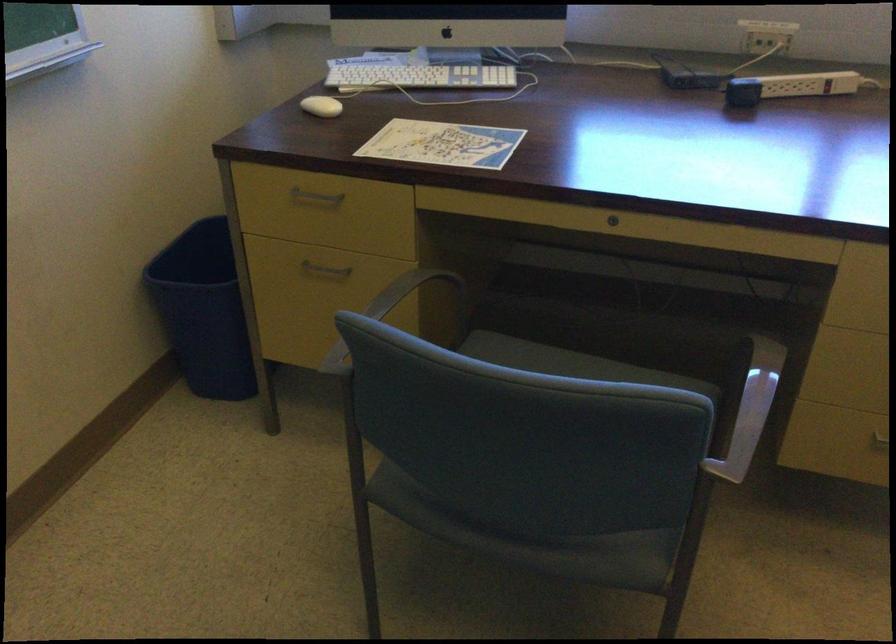
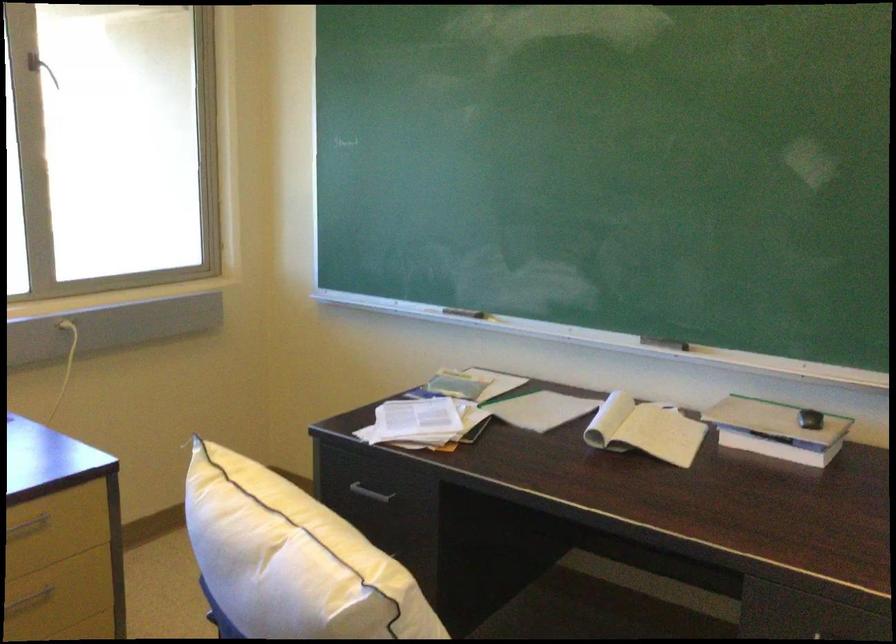
Question: The first image is from the beginning of the video and the second image is from the end. How did the camera likely rotate when shooting the video?

Choices:
 (A) Left
 (B) Right
 (C) Up
 (D) Down

Answer: (B)